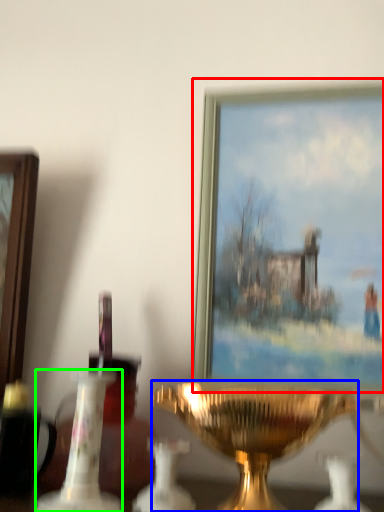
Question: Which object is the farthest from picture frame (highlighted by a red box)? Choose among these: candle holder (highlighted by a blue box) or candle holder (highlighted by a green box).

Choices:
 (A) candle holder
 (B) candle holder

Answer: (B)